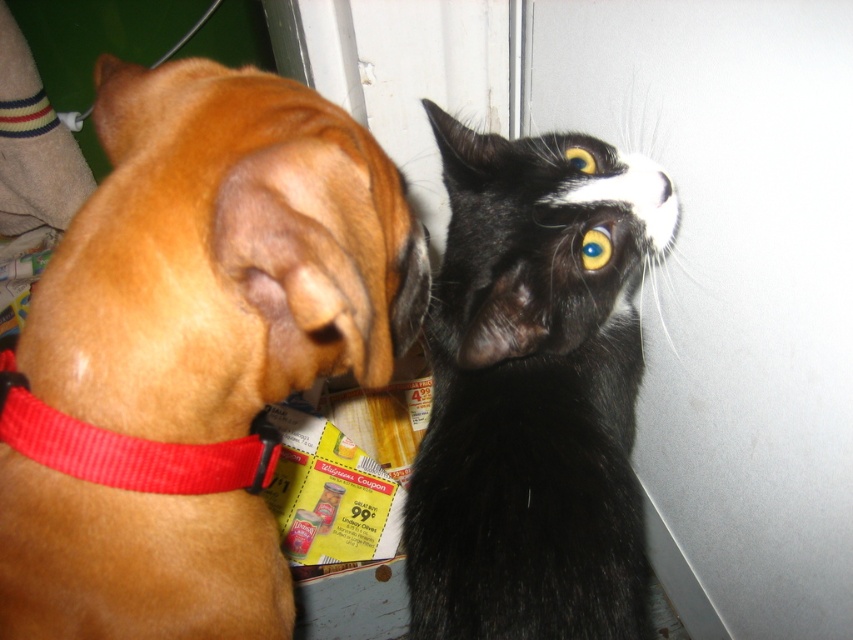
Locate an element on the screen. Image resolution: width=853 pixels, height=640 pixels. brown fur dog at left is located at coordinates (190, 352).

Between brown fur dog at left and black silky fur cat at upper right, which one has more height?

Standing taller between the two is black silky fur cat at upper right.

The height and width of the screenshot is (640, 853). What are the coordinates of `brown fur dog at left` in the screenshot? It's located at click(190, 352).

Which is more to the right, black silky fur cat at upper right or red fabric collar at left?

black silky fur cat at upper right is more to the right.

Does black silky fur cat at upper right appear on the right side of red fabric collar at left?

Yes, black silky fur cat at upper right is to the right of red fabric collar at left.

Is point (604, 460) positioned in front of point (230, 470)?

No, it is behind (230, 470).

Image resolution: width=853 pixels, height=640 pixels. I want to click on black silky fur cat at upper right, so click(x=534, y=392).

Who is positioned more to the left, brown fur dog at left or red fabric collar at left?

From the viewer's perspective, red fabric collar at left appears more on the left side.

Between brown fur dog at left and red fabric collar at left, which one has more height?

brown fur dog at left

Who is more distant from viewer, (230, 326) or (109, 480)?

The point (230, 326) is behind.

Identify the location of brown fur dog at left. (190, 352).